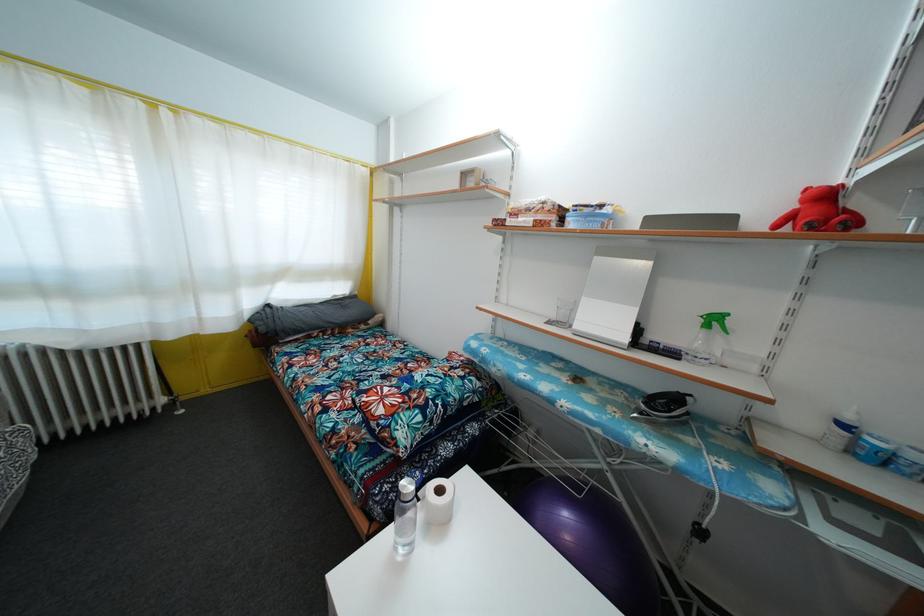
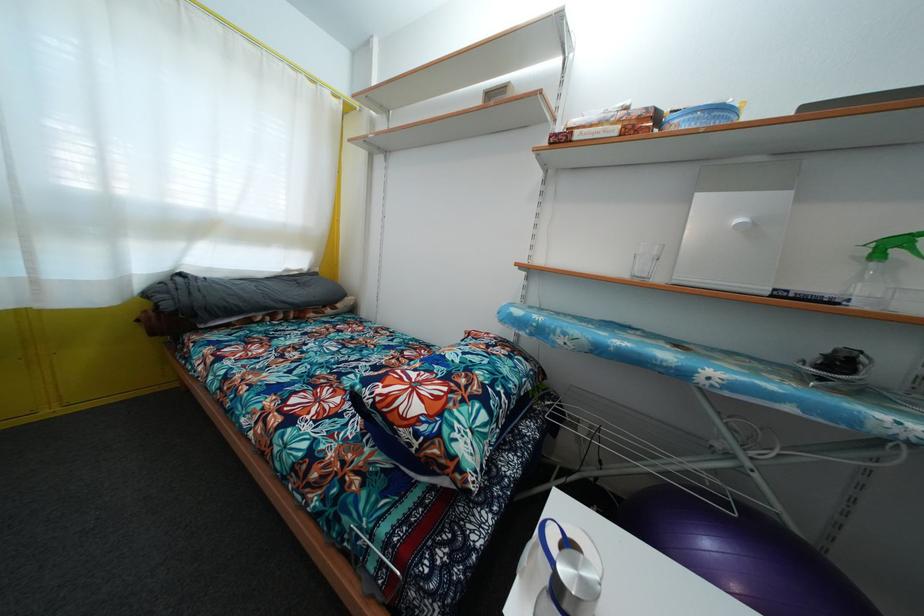
In a continuous first-person perspective shot, in which direction is the camera moving?

The cameraman moved toward left, forward.